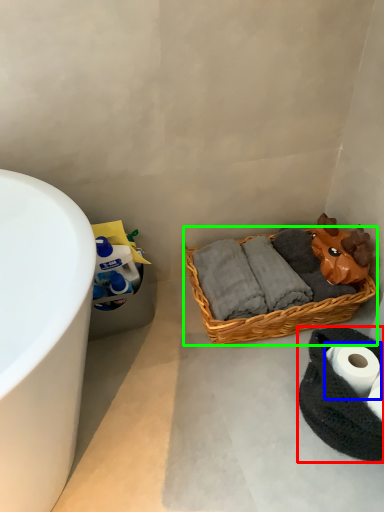
Question: Which object is positioned closest to material (highlighted by a red box)? Select from toilet paper (highlighted by a blue box) and picnic basket (highlighted by a green box).

Choices:
 (A) toilet paper
 (B) picnic basket

Answer: (A)